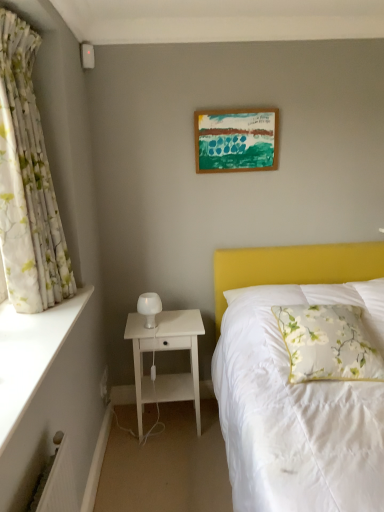
Identify the location of vacant space underneath white floral fabric curtain at left (from a real-world perspective). (57, 305).